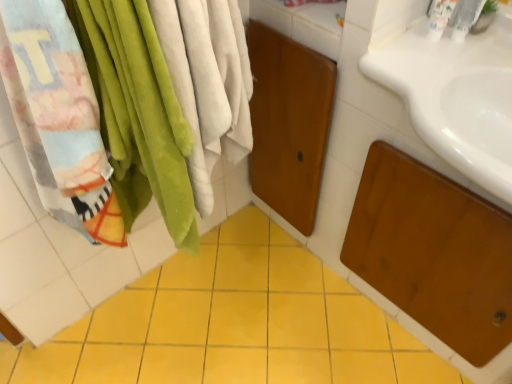
I want to click on unoccupied region to the right of white plastic bottle at upper right, positioned as the second toiletry in right-to-left order, so click(x=480, y=50).